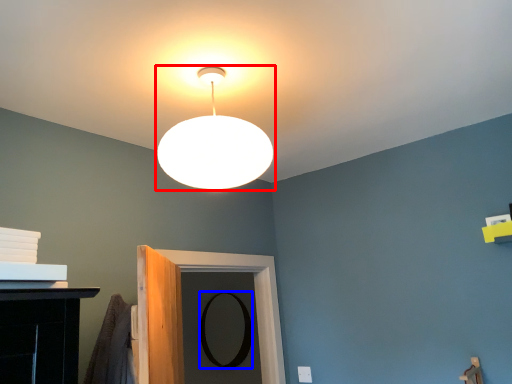
Question: Which object appears farthest to the camera in this image, lamp (highlighted by a red box) or mirror (highlighted by a blue box)?

Choices:
 (A) lamp
 (B) mirror

Answer: (B)